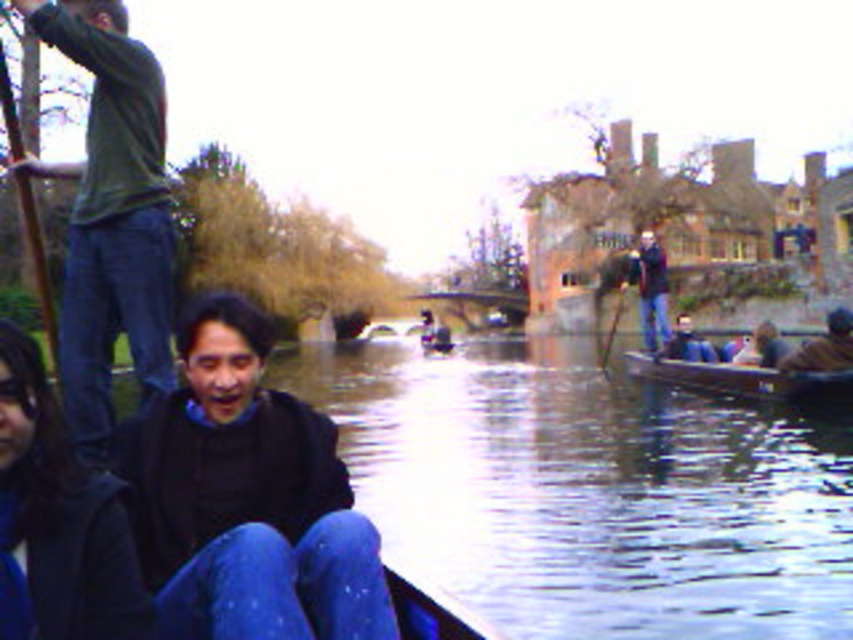
Question: Which point is closer to the camera?

Choices:
 (A) (19, 611)
 (B) (813, 358)
 (C) (691, 330)
 (D) (793, 371)

Answer: (A)

Question: Does green cotton shirt at upper left have a larger size compared to dark blue jeans at center?

Choices:
 (A) yes
 (B) no

Answer: (B)

Question: Which point is farther to the camera?

Choices:
 (A) dark blue jeans at center
 (B) wooden canoe at right

Answer: (A)

Question: Does dark blue sweater at center appear on the left side of green cotton shirt at upper left?

Choices:
 (A) no
 (B) yes

Answer: (A)

Question: Estimate the real-world distances between objects in this image. Which object is farther from the wooden canoe at right?

Choices:
 (A) dark blue sweater at center
 (B) dark brown leather jacket at lower right
 (C) blue denim jeans at lower center
 (D) dark blue jeans at center

Answer: (C)

Question: Is blue denim jeans at lower center below dark brown leather jacket at lower right?

Choices:
 (A) yes
 (B) no

Answer: (A)